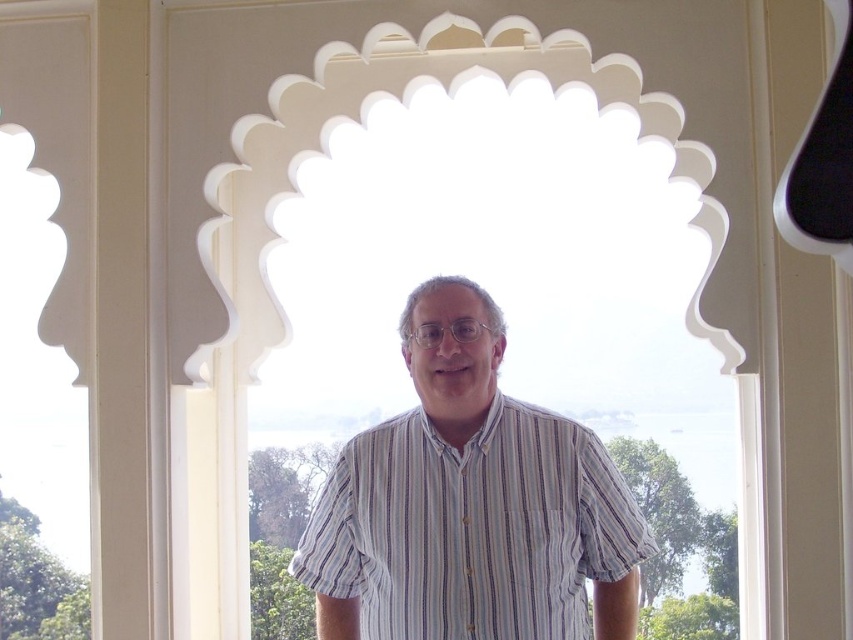
You are an interior designer assessing the proportions of items in the room. Given the white matte window at center and the striped cotton shirt at center, which object is taller?

The white matte window at center is taller than the striped cotton shirt at center according to the description.

You are an architect analyzing the symmetry of the window in the image. The window has a scalloped, arched top with intricate detailing. There is a point marked at coordinates point (399, 97). What does this point represent?

The point (399, 97) indicates the white matte window at center.